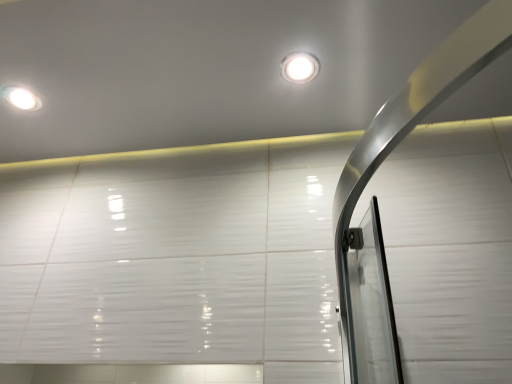
Question: Is white glossy droplight at upper center, the second droplight in the left-to-right sequence, next to matte white droplight at upper left, which is the 2th droplight from right to left, and touching it?

Choices:
 (A) yes
 (B) no

Answer: (B)

Question: Considering the relative positions of white glossy droplight at upper center, the second droplight in the left-to-right sequence, and matte white droplight at upper left, which is the 2th droplight from right to left, in the image provided, is white glossy droplight at upper center, the second droplight in the left-to-right sequence, to the left of matte white droplight at upper left, which is the 2th droplight from right to left, from the viewer's perspective?

Choices:
 (A) yes
 (B) no

Answer: (B)

Question: Does white glossy droplight at upper center, the 1th droplight viewed from the front, have a smaller size compared to matte white droplight at upper left, marked as the first droplight in a back-to-front arrangement?

Choices:
 (A) no
 (B) yes

Answer: (A)

Question: Is white glossy droplight at upper center, the second droplight in the left-to-right sequence, to the right of matte white droplight at upper left, placed as the 1th droplight when sorted from left to right, from the viewer's perspective?

Choices:
 (A) yes
 (B) no

Answer: (A)

Question: From a real-world perspective, is white glossy droplight at upper center, the 1th droplight viewed from the front, positioned over matte white droplight at upper left, placed as the 1th droplight when sorted from left to right, based on gravity?

Choices:
 (A) yes
 (B) no

Answer: (B)

Question: Is white glossy droplight at upper center, the second droplight in the left-to-right sequence, behind matte white droplight at upper left, positioned as the 2th droplight in front-to-back order?

Choices:
 (A) no
 (B) yes

Answer: (A)

Question: Is matte white droplight at upper left, which is the 2th droplight from right to left, taller than white glossy droplight at upper center, placed as the 2th droplight when sorted from back to front?

Choices:
 (A) no
 (B) yes

Answer: (A)

Question: From the image's perspective, is matte white droplight at upper left, which is the 2th droplight from right to left, below white glossy droplight at upper center, the 1th droplight positioned from the right?

Choices:
 (A) no
 (B) yes

Answer: (B)

Question: Can you confirm if matte white droplight at upper left, placed as the 1th droplight when sorted from left to right, is bigger than white glossy droplight at upper center, placed as the 2th droplight when sorted from back to front?

Choices:
 (A) no
 (B) yes

Answer: (A)

Question: Is white glossy droplight at upper center, the 1th droplight positioned from the right, at the back of matte white droplight at upper left, marked as the first droplight in a back-to-front arrangement?

Choices:
 (A) yes
 (B) no

Answer: (B)

Question: Is the position of matte white droplight at upper left, marked as the first droplight in a back-to-front arrangement, more distant than that of white glossy droplight at upper center, the 1th droplight positioned from the right?

Choices:
 (A) yes
 (B) no

Answer: (A)

Question: From a real-world perspective, is matte white droplight at upper left, placed as the 1th droplight when sorted from left to right, positioned over white glossy droplight at upper center, the second droplight in the left-to-right sequence, based on gravity?

Choices:
 (A) yes
 (B) no

Answer: (A)

Question: Is matte white droplight at upper left, which is the 2th droplight from right to left, wider or thinner than white glossy droplight at upper center, placed as the 2th droplight when sorted from back to front?

Choices:
 (A) wide
 (B) thin

Answer: (A)